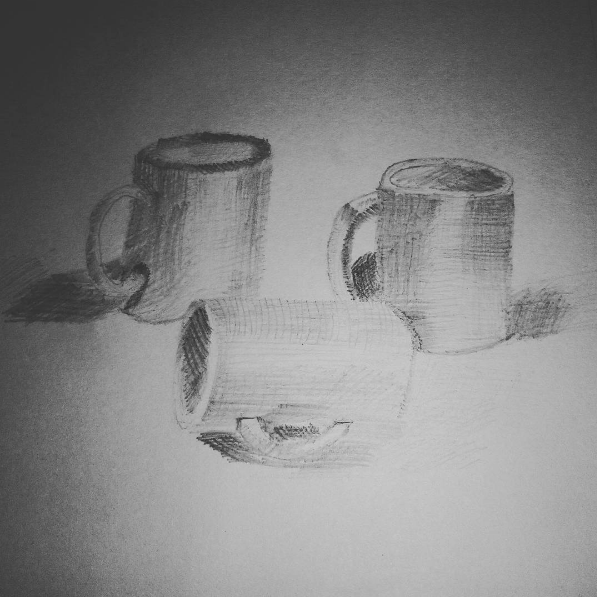
Locate an element on the screen. This screenshot has height=597, width=597. rim of cups is located at coordinates (214, 361), (177, 380), (211, 166), (205, 135), (453, 193), (444, 162).